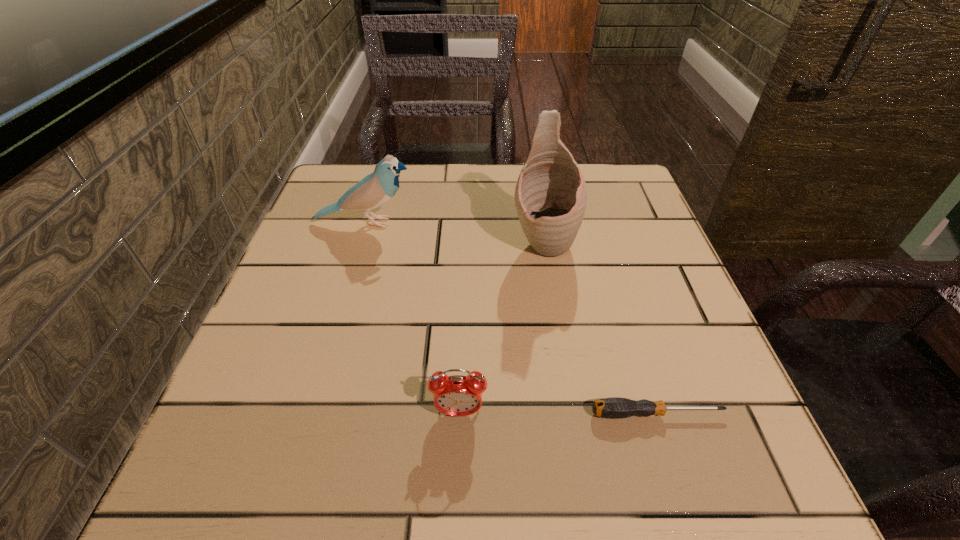
Identify the location of pitcher. (550, 197).

Image resolution: width=960 pixels, height=540 pixels. I want to click on the third shortest object, so coord(375,189).

Find the location of `bird`. bird is located at coordinates (375, 189).

Identify the location of the third tallest object. (457, 395).

What are the coordinates of `alarm clock` in the screenshot? It's located at (457, 395).

You are a GUI agent. You are given a task and a screenshot of the screen. Output one action in this format:
    pyautogui.click(x=<x>, y=<y>)
    Task: Click on the shortest object
    This screenshot has height=540, width=960.
    Given the screenshot: What is the action you would take?
    pyautogui.click(x=615, y=407)

Find the location of a particular element. This screenshot has width=960, height=540. free region located at the spout of the pitcher is located at coordinates (561, 346).

You are a GUI agent. You are given a task and a screenshot of the screen. Output one action in this format:
    pyautogui.click(x=<x>, y=<y>)
    Task: Click on the free space located at the face of the second tallest object
    Image resolution: width=960 pixels, height=540 pixels.
    Given the screenshot: What is the action you would take?
    pyautogui.click(x=544, y=223)

Identify the location of free region located 0.060m on the face of the alarm clock. This screenshot has height=540, width=960. (457, 463).

Locate an element on the screen. The height and width of the screenshot is (540, 960). vacant space located 0.080m on the back of the screwdriver is located at coordinates (639, 360).